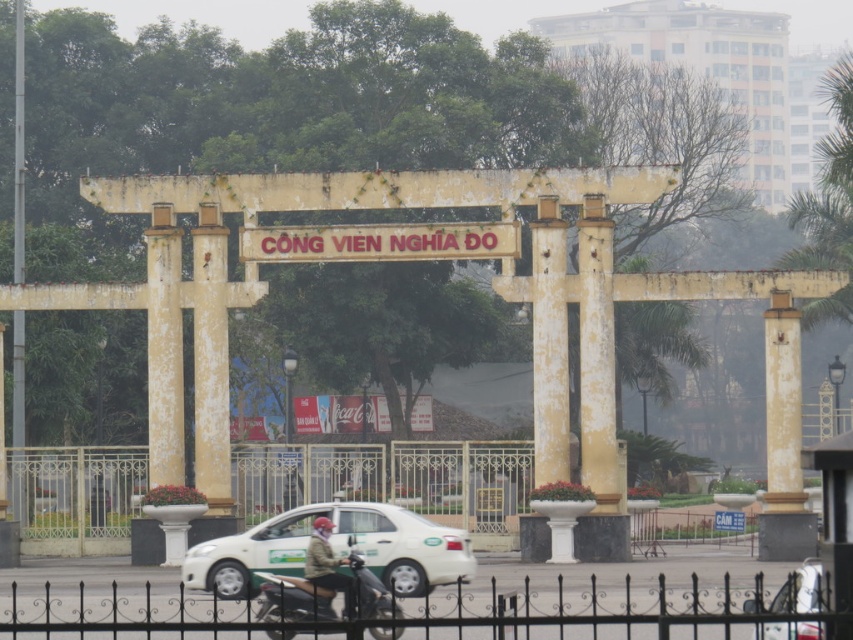
Question: Is black wrought iron fence at lower center smaller than metallic silver motorcycle at center?

Choices:
 (A) yes
 (B) no

Answer: (B)

Question: Which of the following is the farthest from the observer?

Choices:
 (A) white matte taxi at center
 (B) black wrought iron fence at lower center
 (C) green fabric jacket at center
 (D) metallic silver motorcycle at center

Answer: (A)

Question: Which of the following is the closest to the observer?

Choices:
 (A) metallic silver motorcycle at center
 (B) green fabric jacket at center
 (C) black wrought iron fence at lower center
 (D) white matte taxi at center

Answer: (C)

Question: Is black wrought iron fence at lower center closer to the viewer compared to green fabric jacket at center?

Choices:
 (A) no
 (B) yes

Answer: (B)

Question: Among these points, which one is farthest from the camera?

Choices:
 (A) (381, 536)
 (B) (351, 595)
 (C) (399, 636)

Answer: (A)

Question: Does metallic silver motorcycle at center appear over green fabric jacket at center?

Choices:
 (A) yes
 (B) no

Answer: (B)